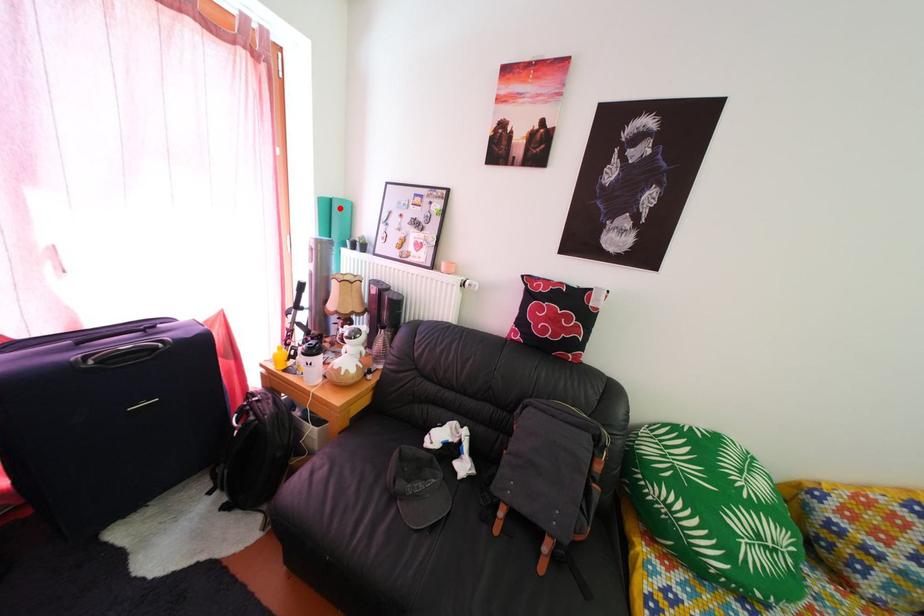
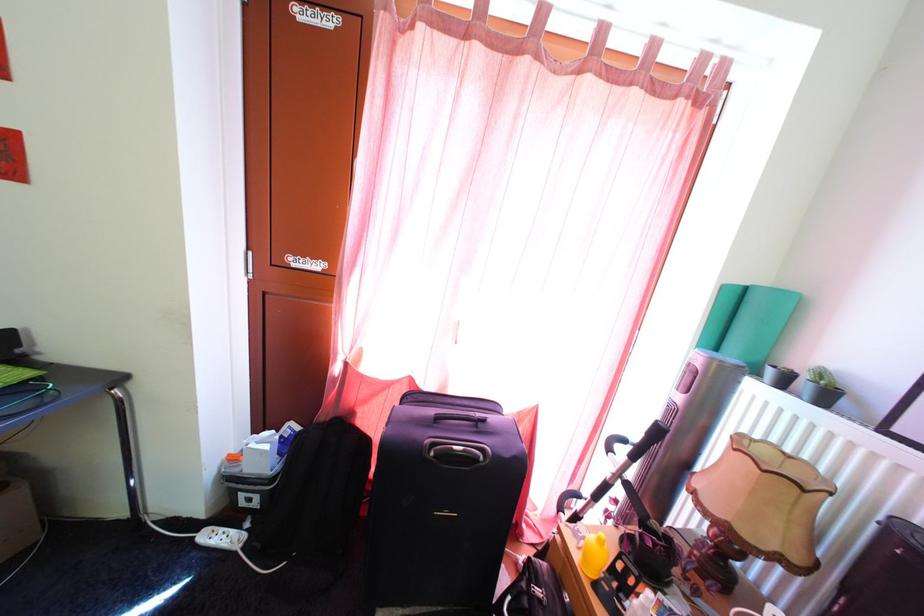
Where in the second image is the point corresponding to the highlighted location from the first image?

(756, 297)